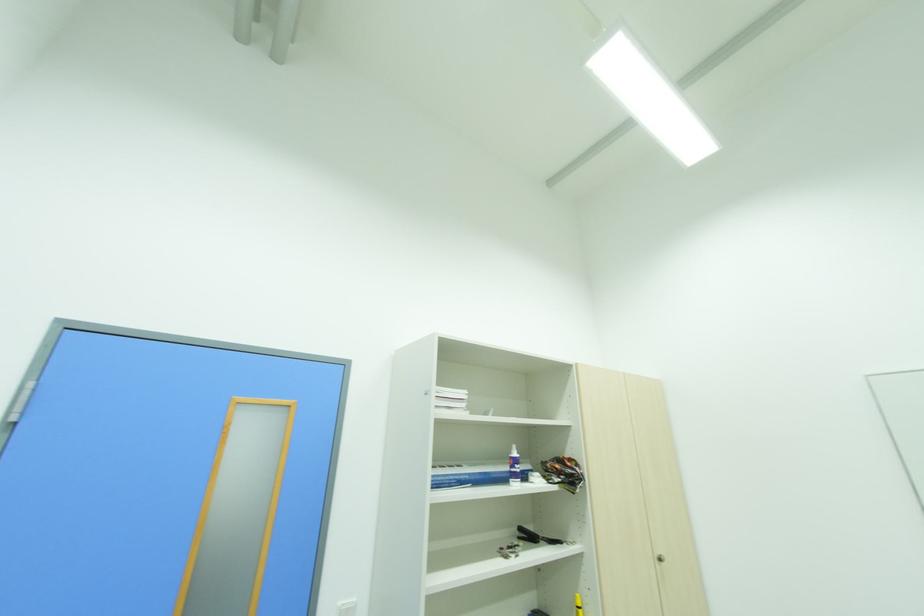
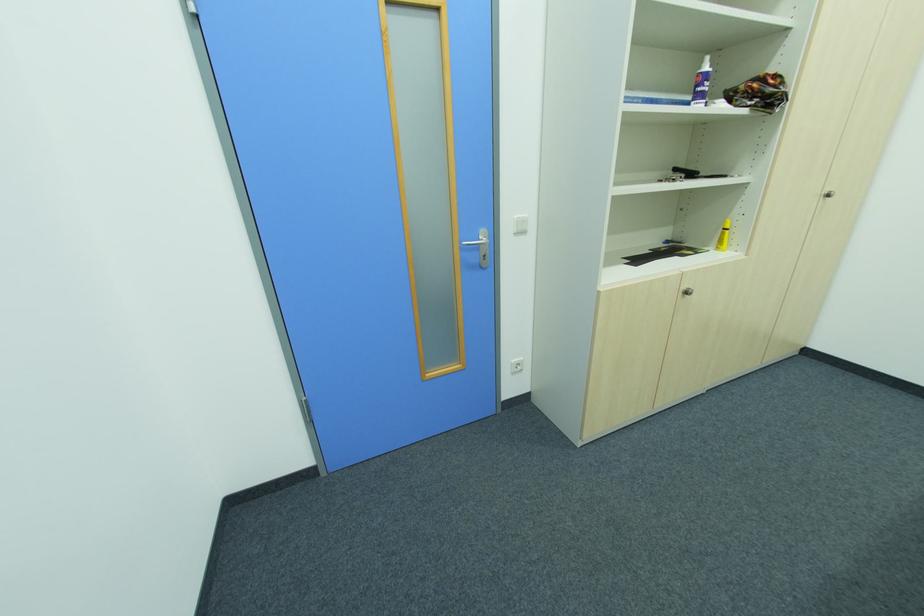
Where in the second image is the point corresponding to (x=517, y=461) from the first image?

(708, 78)